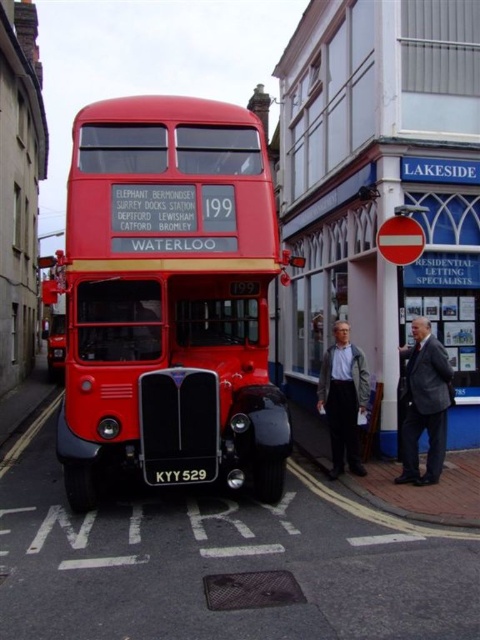
Question: Estimate the real-world distances between objects in this image. Which object is closer to the gray fabric jacket at lower center?

Choices:
 (A) black matte license plate at center
 (B) shiny red bus at center

Answer: (A)

Question: Can you confirm if shiny red bus at center is bigger than black matte license plate at center?

Choices:
 (A) yes
 (B) no

Answer: (B)

Question: Among these points, which one is farthest from the camera?

Choices:
 (A) (421, 388)
 (B) (177, 220)

Answer: (A)

Question: Is shiny red bus at center above dark gray suit at center?

Choices:
 (A) yes
 (B) no

Answer: (A)

Question: Which point appears farthest from the camera in this image?

Choices:
 (A) (167, 195)
 (B) (434, 340)

Answer: (B)

Question: Is shiny red bus at center in front of black matte license plate at center?

Choices:
 (A) yes
 (B) no

Answer: (B)